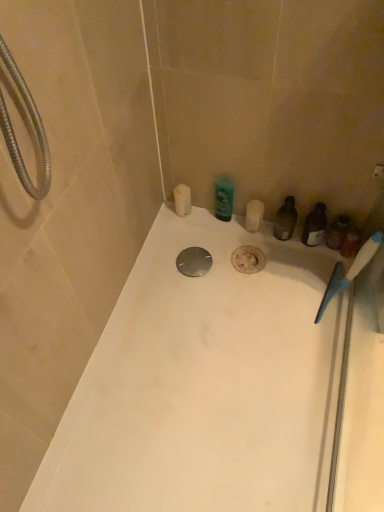
Where is `unoccupied area in front of white matte candle at upper left, the first toiletry from the left`? The height and width of the screenshot is (512, 384). unoccupied area in front of white matte candle at upper left, the first toiletry from the left is located at coordinates (184, 249).